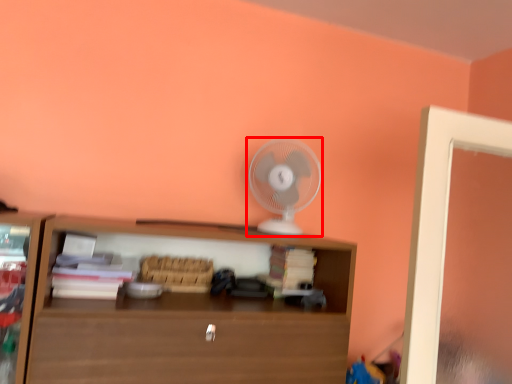
Question: From the image's perspective, what is the correct spatial relationship of mechanical fan (annotated by the red box) in relation to shelf?

Choices:
 (A) above
 (B) below

Answer: (A)